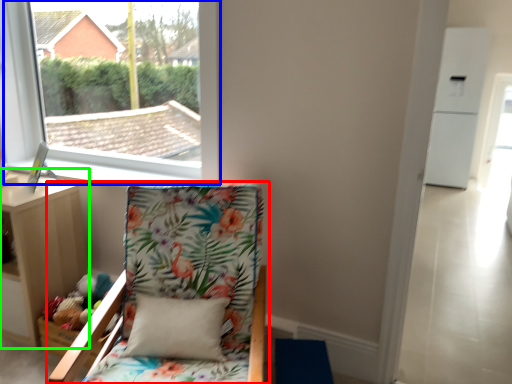
Question: Which object is positioned closest to chair (highlighted by a red box)? Select from window (highlighted by a blue box) and nightstand (highlighted by a green box).

Choices:
 (A) window
 (B) nightstand

Answer: (B)